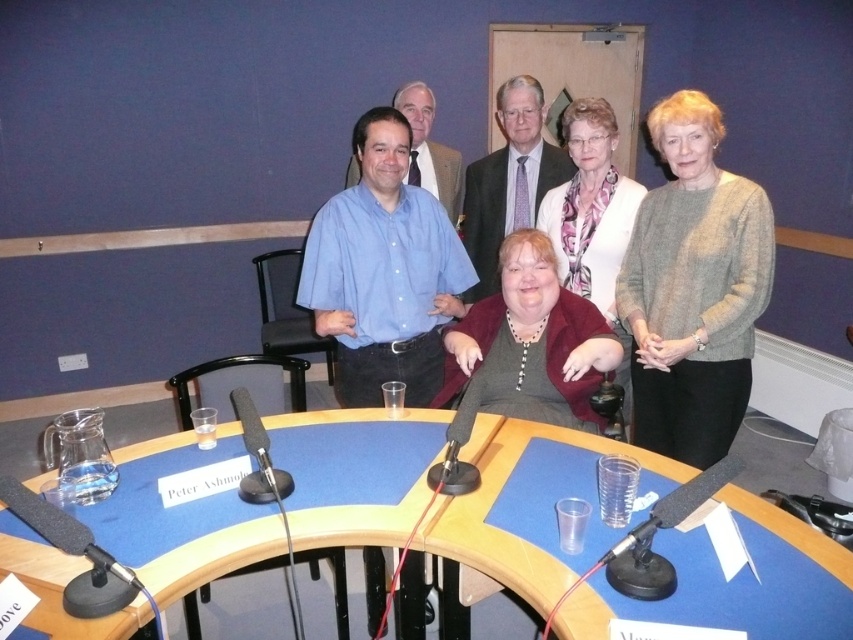
Question: From the image, what is the correct spatial relationship of matte burgundy sweater at center in relation to light brown suit at center?

Choices:
 (A) right
 (B) left

Answer: (A)

Question: Does light brown suit at center appear on the left side of matte blue shirt at center?

Choices:
 (A) no
 (B) yes

Answer: (A)

Question: Which point is farther to the camera?

Choices:
 (A) (329, 323)
 (B) (482, 237)
 (C) (428, 109)
 (D) (384, 420)

Answer: (C)

Question: Which object is the closest to the gray sweater at upper right?

Choices:
 (A) blue wood table at center
 (B) light brown suit at center
 (C) matte blue shirt at center

Answer: (A)

Question: Which of these objects is positioned farthest from the matte burgundy sweater at center?

Choices:
 (A) blue wood table at center
 (B) blue cotton shirt at center

Answer: (A)

Question: Is velvet burgundy sweater at center above matte blue shirt at center?

Choices:
 (A) yes
 (B) no

Answer: (B)